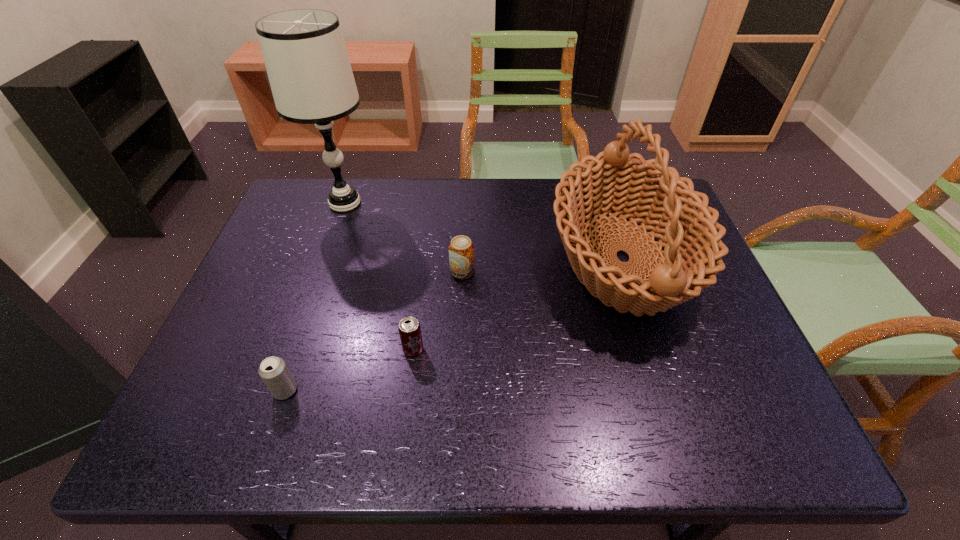
The height and width of the screenshot is (540, 960). I want to click on the tallest object, so click(304, 52).

You are a GUI agent. You are given a task and a screenshot of the screen. Output one action in this format:
    pyautogui.click(x=<x>, y=<y>)
    Task: Click on the basket
    This screenshot has width=960, height=540.
    Given the screenshot: What is the action you would take?
    pyautogui.click(x=652, y=193)

At what (x,y) coordinates should I click in order to perform the action: click on the fourth shortest object. Please return your answer as a coordinate pair (x, y). This screenshot has width=960, height=540. Looking at the image, I should click on (652, 193).

You are a GUI agent. You are given a task and a screenshot of the screen. Output one action in this format:
    pyautogui.click(x=<x>, y=<y>)
    Task: Click on the second object from right to left
    
    Given the screenshot: What is the action you would take?
    pyautogui.click(x=461, y=250)

What are the coordinates of `the farthest beer can` in the screenshot? It's located at (461, 250).

This screenshot has width=960, height=540. I want to click on the nearest object, so click(x=274, y=372).

You are a GUI agent. You are given a task and a screenshot of the screen. Output one action in this format:
    pyautogui.click(x=<x>, y=<y>)
    Task: Click on the nearest beer can
    This screenshot has height=540, width=960.
    Given the screenshot: What is the action you would take?
    pyautogui.click(x=274, y=372)

Locate an element on the screen. the second beer can from right to left is located at coordinates (409, 328).

Locate an element on the screen. This screenshot has height=540, width=960. the third object from left to right is located at coordinates (409, 328).

Identify the location of vacant space located on the front of the table lamp. (305, 315).